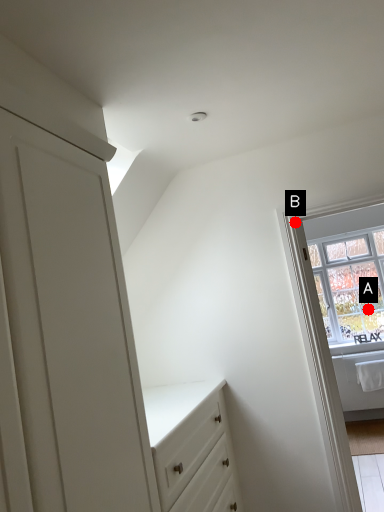
Question: Two points are circled on the image, labeled by A and B beside each circle. Which point is closer to the camera taking this photo?

Choices:
 (A) A is closer
 (B) B is closer

Answer: (B)